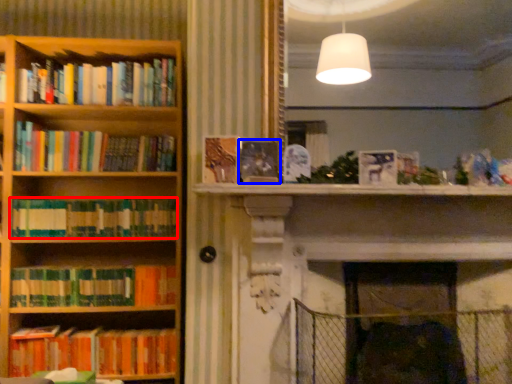
Question: Which object is further to the camera taking this photo, book (highlighted by a red box) or book (highlighted by a blue box)?

Choices:
 (A) book
 (B) book

Answer: (A)